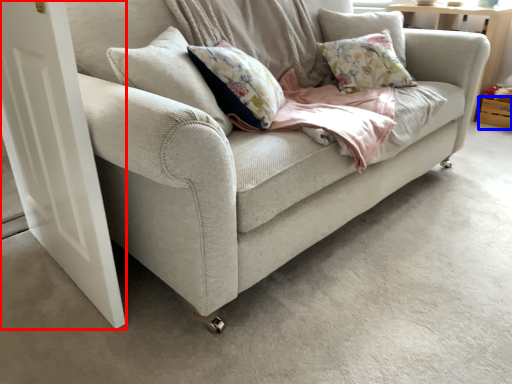
Question: Which object appears closest to the camera in this image, screen door (highlighted by a red box) or drawer (highlighted by a blue box)?

Choices:
 (A) screen door
 (B) drawer

Answer: (A)